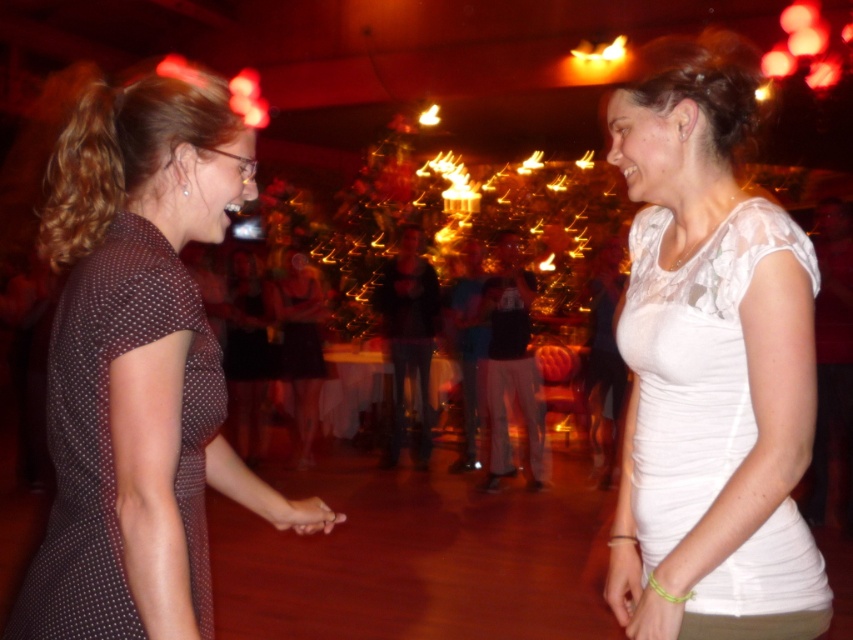
Can you confirm if dark brown dotted dress at left is shorter than black mesh dress at center?

No, dark brown dotted dress at left is not shorter than black mesh dress at center.

Which is in front, point (112, 596) or point (291, 300)?

Point (112, 596) is in front.

Does point (67, 243) lie behind point (281, 298)?

That is False.

Find the location of a particular element. This screenshot has width=853, height=640. dark brown dotted dress at left is located at coordinates (135, 355).

Does dark brown sheer dress at left appear on the right side of yellow rubber band at lower right?

Incorrect, dark brown sheer dress at left is not on the right side of yellow rubber band at lower right.

Is point (76, 525) farther from camera compared to point (668, 621)?

No.

Does point (96, 420) come in front of point (659, 612)?

Yes, it is in front of point (659, 612).

Identify the location of dark brown sheer dress at left. (109, 435).

Identify the location of dark brown dotted dress at left. (135, 355).

Does point (183, 362) lie in front of point (641, 596)?

Yes, it is.

This screenshot has width=853, height=640. I want to click on dark brown dotted dress at left, so click(x=135, y=355).